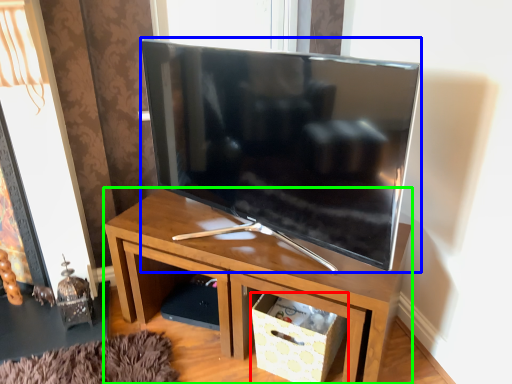
Question: Which object is positioned farthest from storage box (highlighted by a red box)? Select from television (highlighted by a blue box) and desk (highlighted by a green box).

Choices:
 (A) television
 (B) desk

Answer: (A)